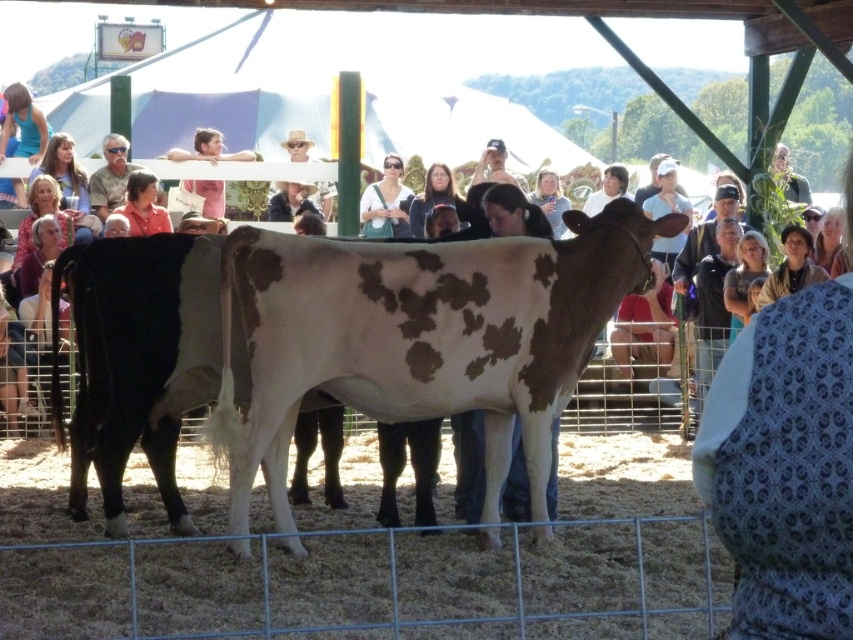
You are standing at the point marked as point (453,339). The two cows are in front of you. How far apart are the two cows from each other?

The two cows are 8.10 meters apart from each other.

In the scene shown: You are a photographer at the livestock show. You need to position yourself so that the white spotted fur at center and the matte white shirt at center are both visible in your shot. Which object should you ensure is to the left side of your frame to capture both?

To capture both the white spotted fur at center and the matte white shirt at center in your shot, you should position the matte white shirt at center on the left side of your frame since the white spotted fur at center is already to the right of it.

Based on the photo, you are a photographer at the livestock show. You need to capture a photo that includes both the white spotted fur at center and the smooth skin face at upper center. Based on their sizes, which object should you focus on to ensure both fit in the frame?

The white spotted fur at center is wider than the smooth skin face at upper center. To ensure both fit in the frame, focus on the white spotted fur at center since it is wider, allowing the smaller smooth skin face at upper center to be included as well.